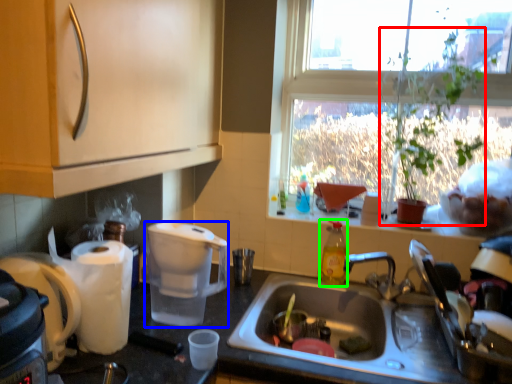
Question: Considering the real-world distances, which object is closest to houseplant (highlighted by a red box)? coffee maker (highlighted by a blue box) or bottle (highlighted by a green box).

Choices:
 (A) coffee maker
 (B) bottle

Answer: (B)